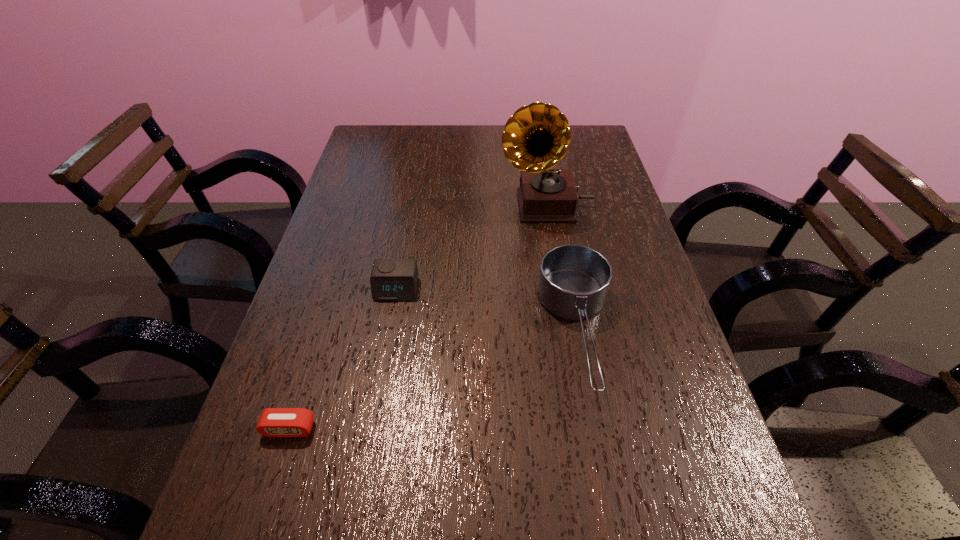
I want to click on vacant region between the farther alarm clock and the saucepan, so click(x=487, y=310).

Image resolution: width=960 pixels, height=540 pixels. Find the location of `free space between the third tallest object and the third shortest object`. free space between the third tallest object and the third shortest object is located at coordinates (487, 310).

At what (x,y) coordinates should I click in order to perform the action: click on unoccupied area between the saucepan and the right alarm clock. Please return your answer as a coordinate pair (x, y). Image resolution: width=960 pixels, height=540 pixels. Looking at the image, I should click on (487, 310).

Where is `free space that is in between the left alarm clock and the third shortest object`? free space that is in between the left alarm clock and the third shortest object is located at coordinates (434, 380).

Where is `vacant area that lies between the nearer alarm clock and the farthest object`? vacant area that lies between the nearer alarm clock and the farthest object is located at coordinates pos(418,317).

Identify the location of unoccupied position between the right alarm clock and the left alarm clock. (343, 359).

Find the location of `free spot between the third object from right to left and the saucepan`. free spot between the third object from right to left and the saucepan is located at coordinates (487, 310).

Identify the location of unoccupied area between the leftmost object and the third object from right to left. Image resolution: width=960 pixels, height=540 pixels. (343, 359).

Where is `object that stands as the closest to the nearest object`? object that stands as the closest to the nearest object is located at coordinates (391, 279).

This screenshot has width=960, height=540. In order to click on object that is the second closest one to the farthest object in this screenshot , I will do `click(391, 279)`.